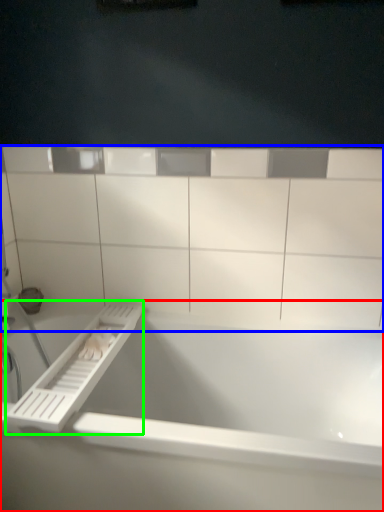
Question: Estimate the real-world distances between objects in this image. Which object is closer to bathtub (highlighted by a red box), ledge (highlighted by a blue box) or towel bar (highlighted by a green box)?

Choices:
 (A) ledge
 (B) towel bar

Answer: (B)